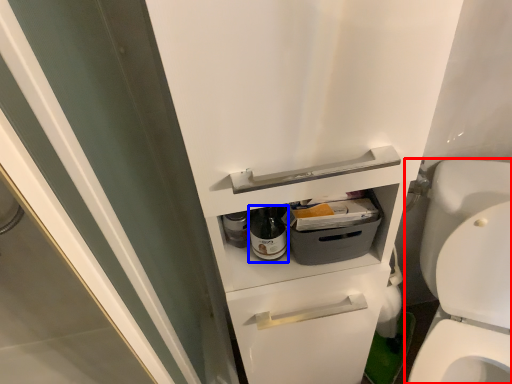
Question: Which of the following is the closest to the observer, toilet (highlighted by a red box) or bottle (highlighted by a blue box)?

Choices:
 (A) toilet
 (B) bottle

Answer: (A)